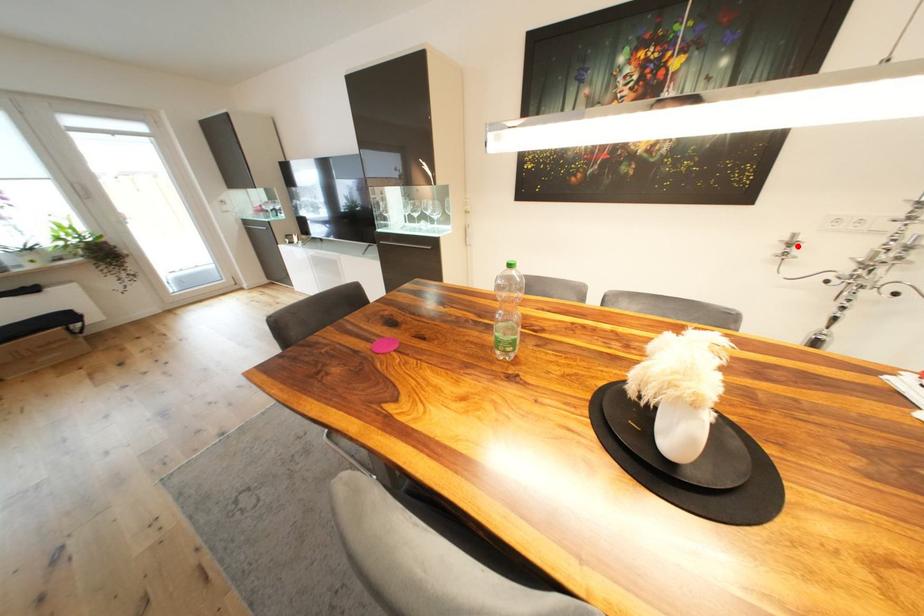
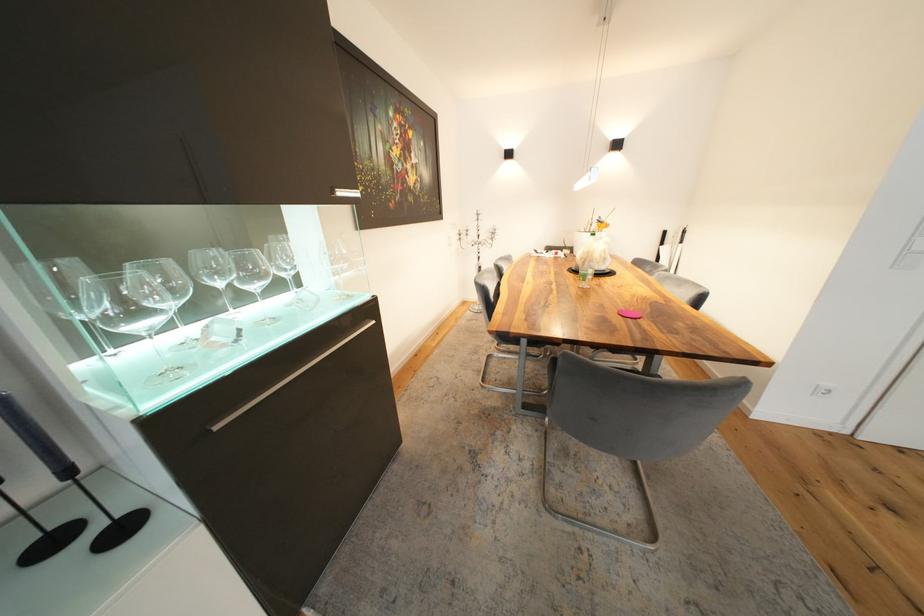
Question: A red point is marked in image1. In image2, is the corresponding 3D point closer to the camera or farther? Reply with the corresponding letter.

Choices:
 (A) The corresponding 3D point is closer.
 (B) The corresponding 3D point is farther.

Answer: (A)